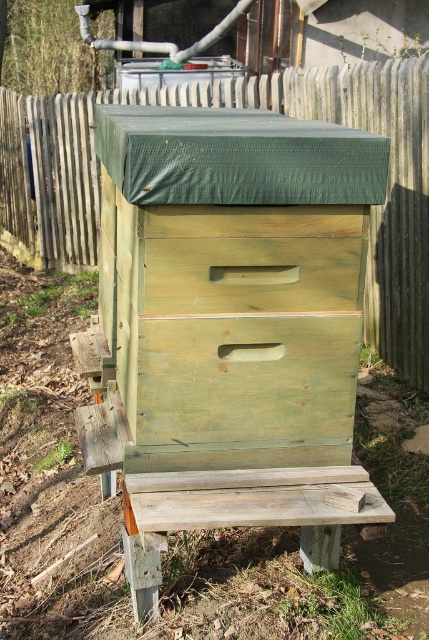
Which is behind, point (410, 380) or point (213, 477)?

Positioned behind is point (410, 380).

Does weathered wood fence at upper center appear on the right side of weathered wood bench at lower center?

No, weathered wood fence at upper center is not to the right of weathered wood bench at lower center.

This screenshot has width=429, height=640. What do you see at coordinates (236, 106) in the screenshot?
I see `weathered wood fence at upper center` at bounding box center [236, 106].

Identify the location of weathered wood fence at upper center. (236, 106).